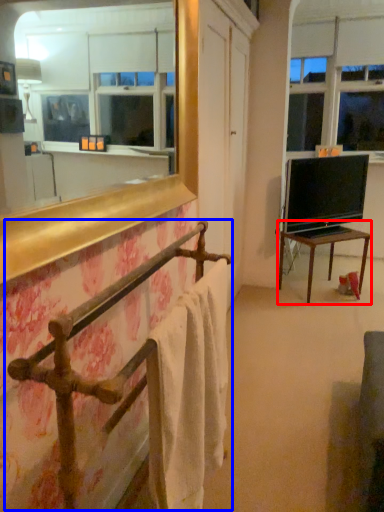
Question: Which point is closer to the camera, table (highlighted by a red box) or balustrade (highlighted by a blue box)?

Choices:
 (A) table
 (B) balustrade

Answer: (B)